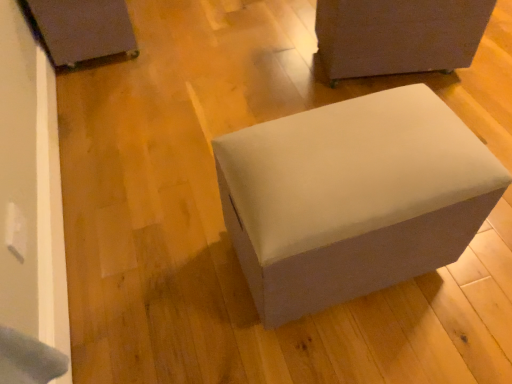
Question: From a real-world perspective, is suede-like gray ottoman at center, which appears as the 2th furniture when viewed from the left, over matte gray ottoman at upper right, arranged as the 3th furniture when viewed from the left?

Choices:
 (A) yes
 (B) no

Answer: (A)

Question: Considering the relative positions of suede-like gray ottoman at center, placed as the 2th furniture when sorted from right to left, and matte gray ottoman at upper right, the 1th furniture in the right-to-left sequence, in the image provided, is suede-like gray ottoman at center, placed as the 2th furniture when sorted from right to left, to the left of matte gray ottoman at upper right, the 1th furniture in the right-to-left sequence, from the viewer's perspective?

Choices:
 (A) yes
 (B) no

Answer: (A)

Question: From the image's perspective, does suede-like gray ottoman at center, which appears as the 2th furniture when viewed from the left, appear higher than matte gray ottoman at upper right, the 1th furniture in the right-to-left sequence?

Choices:
 (A) yes
 (B) no

Answer: (B)

Question: Can you confirm if suede-like gray ottoman at center, placed as the 2th furniture when sorted from right to left, is smaller than matte gray ottoman at upper right, arranged as the 3th furniture when viewed from the left?

Choices:
 (A) yes
 (B) no

Answer: (B)

Question: From a real-world perspective, is suede-like gray ottoman at center, placed as the 2th furniture when sorted from right to left, beneath matte gray ottoman at upper right, arranged as the 3th furniture when viewed from the left?

Choices:
 (A) yes
 (B) no

Answer: (B)

Question: Is suede-like gray ottoman at center, which appears as the 2th furniture when viewed from the left, not close to matte gray ottoman at upper right, arranged as the 3th furniture when viewed from the left?

Choices:
 (A) no
 (B) yes

Answer: (A)

Question: Considering the relative sizes of matte gray ottoman at upper right, arranged as the 3th furniture when viewed from the left, and suede-like gray ottoman at center, placed as the 2th furniture when sorted from right to left, in the image provided, is matte gray ottoman at upper right, arranged as the 3th furniture when viewed from the left, shorter than suede-like gray ottoman at center, placed as the 2th furniture when sorted from right to left,?

Choices:
 (A) yes
 (B) no

Answer: (A)

Question: Is matte gray ottoman at upper right, the 1th furniture in the right-to-left sequence, placed right next to suede-like gray ottoman at center, which appears as the 2th furniture when viewed from the left?

Choices:
 (A) no
 (B) yes

Answer: (A)

Question: Is suede-like gray ottoman at center, which appears as the 2th furniture when viewed from the left, surrounded by matte gray ottoman at upper right, arranged as the 3th furniture when viewed from the left?

Choices:
 (A) no
 (B) yes

Answer: (A)

Question: From the image's perspective, would you say matte gray ottoman at upper right, arranged as the 3th furniture when viewed from the left, is shown under suede-like gray ottoman at center, which appears as the 2th furniture when viewed from the left?

Choices:
 (A) no
 (B) yes

Answer: (A)

Question: Is matte gray ottoman at upper right, the 1th furniture in the right-to-left sequence, in front of suede-like gray ottoman at center, placed as the 2th furniture when sorted from right to left?

Choices:
 (A) no
 (B) yes

Answer: (A)

Question: Can you confirm if matte gray ottoman at upper right, arranged as the 3th furniture when viewed from the left, is bigger than suede-like gray ottoman at center, which appears as the 2th furniture when viewed from the left?

Choices:
 (A) yes
 (B) no

Answer: (B)

Question: Considering the relative sizes of matte black box at upper left, acting as the third furniture starting from the right, and matte gray ottoman at upper right, arranged as the 3th furniture when viewed from the left, in the image provided, is matte black box at upper left, acting as the third furniture starting from the right, smaller than matte gray ottoman at upper right, arranged as the 3th furniture when viewed from the left,?

Choices:
 (A) no
 (B) yes

Answer: (B)